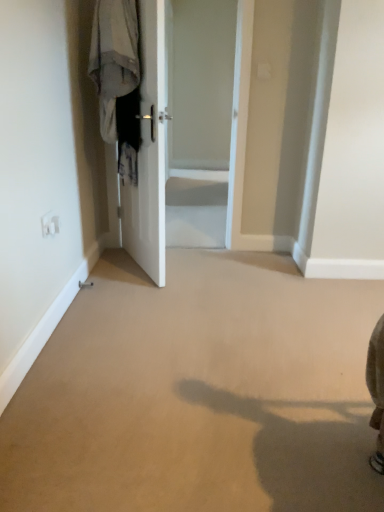
Question: From the image's perspective, does white glossy door at center appear higher than light gray fabric at left?

Choices:
 (A) yes
 (B) no

Answer: (B)

Question: From a real-world perspective, is white glossy door at center located higher than light gray fabric at left?

Choices:
 (A) yes
 (B) no

Answer: (B)

Question: Are white glossy door at center and light gray fabric at left making contact?

Choices:
 (A) no
 (B) yes

Answer: (A)

Question: Would you consider white glossy door at center to be distant from light gray fabric at left?

Choices:
 (A) yes
 (B) no

Answer: (A)

Question: From the image's perspective, is white glossy door at center below light gray fabric at left?

Choices:
 (A) yes
 (B) no

Answer: (A)

Question: Relative to white glossy door at center, is white glossy door at center in front or behind?

Choices:
 (A) behind
 (B) front

Answer: (A)

Question: Considering the positions of white glossy door at center and white glossy door at center in the image, is white glossy door at center taller or shorter than white glossy door at center?

Choices:
 (A) tall
 (B) short

Answer: (A)

Question: Is white glossy door at center bigger or smaller than white glossy door at center?

Choices:
 (A) big
 (B) small

Answer: (A)

Question: Choose the correct answer: Is white glossy door at center inside white glossy door at center or outside it?

Choices:
 (A) outside
 (B) inside

Answer: (A)

Question: Considering the relative positions of white glossy door at center and light gray fabric at left in the image provided, is white glossy door at center to the left or to the right of light gray fabric at left?

Choices:
 (A) left
 (B) right

Answer: (B)

Question: Is white glossy door at center inside or outside of light gray fabric at left?

Choices:
 (A) inside
 (B) outside

Answer: (B)

Question: In terms of width, does white glossy door at center look wider or thinner when compared to light gray fabric at left?

Choices:
 (A) thin
 (B) wide

Answer: (A)

Question: From a real-world perspective, is white glossy door at center above or below light gray fabric at left?

Choices:
 (A) above
 (B) below

Answer: (B)

Question: Is light gray fabric at left taller or shorter than white glossy door at center?

Choices:
 (A) tall
 (B) short

Answer: (B)

Question: From a real-world perspective, relative to white glossy door at center, is light gray fabric at left vertically above or below?

Choices:
 (A) below
 (B) above

Answer: (B)